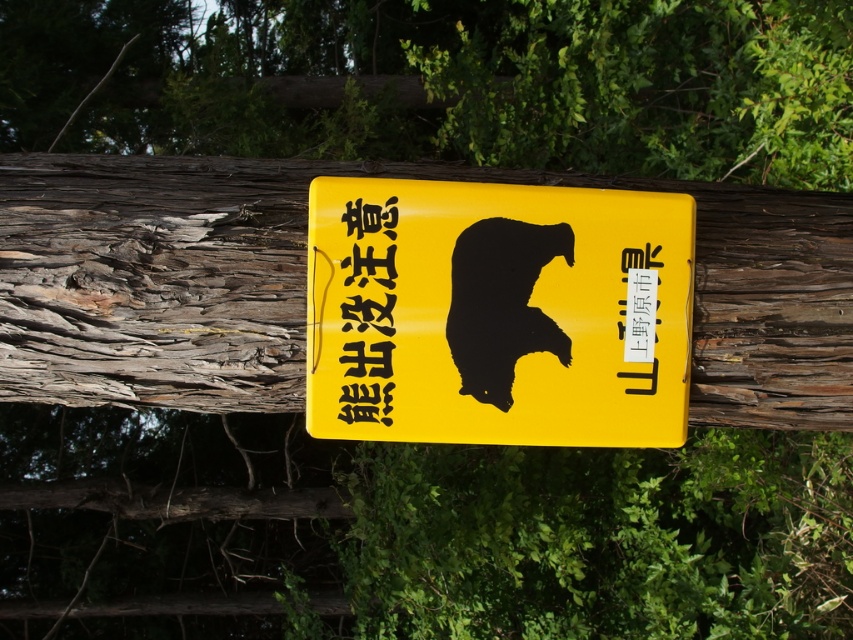
You are a hiker who just spotted a warning sign in the woods. You see a yellow matte signboard at center and a yellow paper at center. Which object is positioned more to the right?

The yellow matte signboard at center is positioned to the right of the yellow paper at center, so the yellow matte signboard at center is more to the right.

You are a hiker who just found a sign in the forest. You see a yellow matte signboard at center and a yellow paper at center. Which one is closer to you?

The yellow paper at center is closer to you because the yellow matte signboard at center is positioned under it.